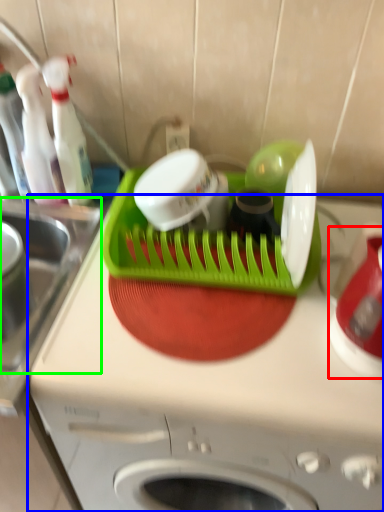
Question: Considering the real-world distances, which object is farthest from appliance (highlighted by a red box)? home appliance (highlighted by a blue box) or sink (highlighted by a green box)?

Choices:
 (A) home appliance
 (B) sink

Answer: (B)